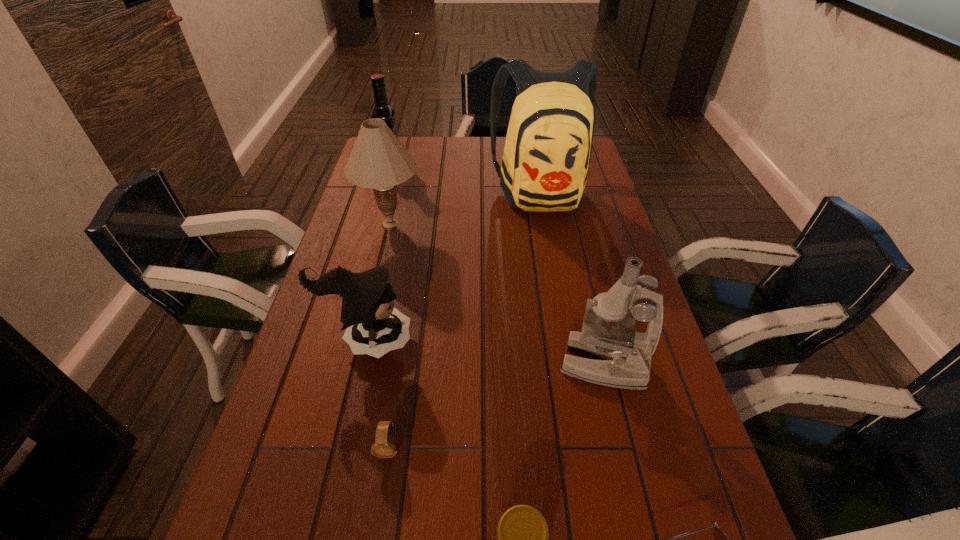
You are a GUI agent. You are given a task and a screenshot of the screen. Output one action in this format:
    pyautogui.click(x=<x>, y=<y>)
    Task: Click on the backpack
    The height and width of the screenshot is (540, 960).
    Given the screenshot: What is the action you would take?
    548,146

This screenshot has height=540, width=960. I want to click on lampshade, so click(x=378, y=160).

Find the location of a particular element. liquor is located at coordinates (382, 110).

At what (x,y) coordinates should I click in order to perform the action: click on microscope. Please return your answer as a coordinate pair (x, y). Looking at the image, I should click on (624, 355).

This screenshot has width=960, height=540. What are the coordinates of `doll` in the screenshot? It's located at (374, 326).

The height and width of the screenshot is (540, 960). What are the coordinates of `the sixth farthest object` in the screenshot? It's located at (383, 447).

Where is `watch`? This screenshot has width=960, height=540. watch is located at coordinates (383, 447).

Image resolution: width=960 pixels, height=540 pixels. Identify the location of vacant point located 0.220m on the front-facing side of the backpack. (556, 273).

Where is `free space located on the front of the lampshade`? The width and height of the screenshot is (960, 540). free space located on the front of the lampshade is located at coordinates (363, 340).

I want to click on free spot located on the front-facing side of the liquor, so click(x=495, y=164).